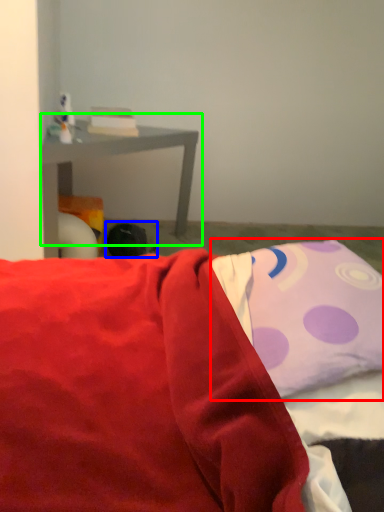
Question: Based on their relative distances, which object is farther from pillow (highlighted by a red box)? Choose from bean bag chair (highlighted by a blue box) and table (highlighted by a green box).

Choices:
 (A) bean bag chair
 (B) table

Answer: (B)